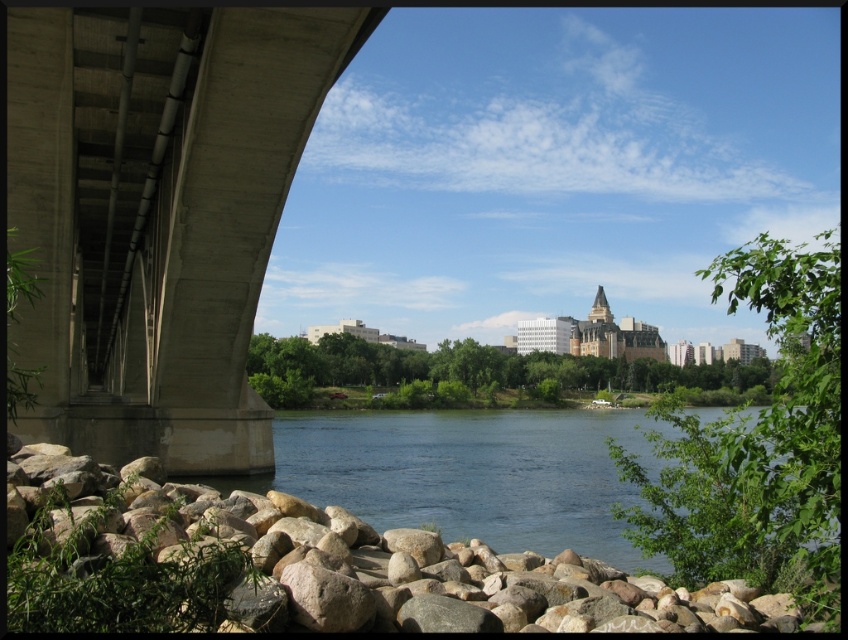
Question: Does concrete bridge at left appear on the left side of smooth brown rock at lower left?

Choices:
 (A) no
 (B) yes

Answer: (B)

Question: Does concrete bridge at left have a lesser width compared to smooth brown rock at lower left?

Choices:
 (A) yes
 (B) no

Answer: (B)

Question: Which object appears farthest from the camera in this image?

Choices:
 (A) concrete bridge at left
 (B) smooth brown rock at lower left

Answer: (A)

Question: Which object is closer to the camera taking this photo?

Choices:
 (A) smooth brown rock at lower left
 (B) concrete bridge at left

Answer: (A)

Question: Is concrete bridge at left above smooth brown rock at lower left?

Choices:
 (A) no
 (B) yes

Answer: (B)